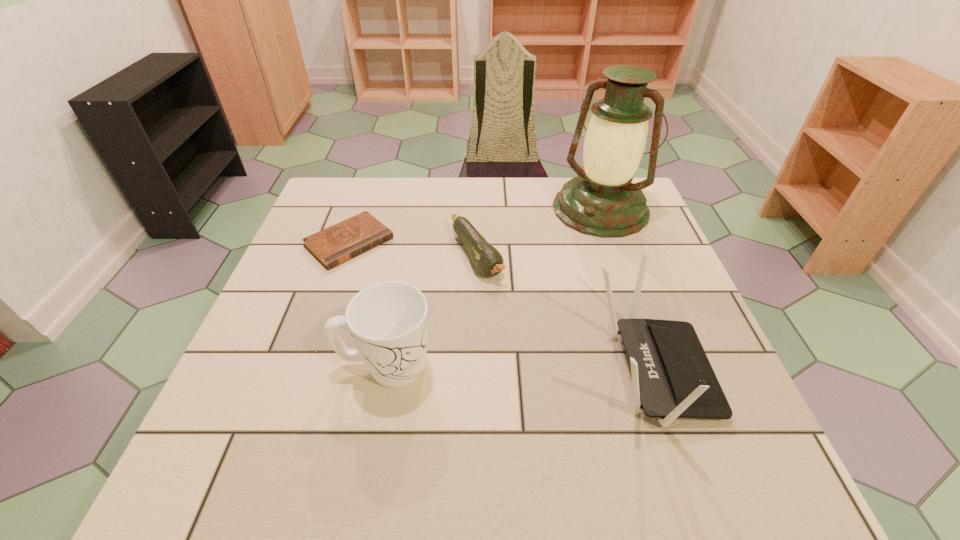
Where is `unoccupied position between the diary and the fourth tallest object`? This screenshot has height=540, width=960. unoccupied position between the diary and the fourth tallest object is located at coordinates (413, 249).

You are a GUI agent. You are given a task and a screenshot of the screen. Output one action in this format:
    pyautogui.click(x=<x>, y=<y>)
    Task: Click on the vacant region between the third object from right to left and the shortest object
    The image size is (960, 540).
    Given the screenshot: What is the action you would take?
    pyautogui.click(x=413, y=249)

Image resolution: width=960 pixels, height=540 pixels. Identify the location of unoccupied area between the diary and the tallest object. (475, 226).

At what (x,y) coordinates should I click in order to perform the action: click on vacant area that lies between the diary and the third object from right to left. Please return your answer as a coordinate pair (x, y). The height and width of the screenshot is (540, 960). Looking at the image, I should click on (413, 249).

Find the location of a particular element. This screenshot has width=960, height=540. free space between the mug and the lantern is located at coordinates (493, 288).

In order to click on free area in between the diary and the lantern in this screenshot , I will do `click(475, 226)`.

You are a GUI agent. You are given a task and a screenshot of the screen. Output one action in this format:
    pyautogui.click(x=<x>, y=<y>)
    Task: Click on the blank region between the tallest object and the router
    This screenshot has height=540, width=960.
    Given the screenshot: What is the action you would take?
    pyautogui.click(x=626, y=291)

You are a GUI agent. You are given a task and a screenshot of the screen. Output one action in this format:
    pyautogui.click(x=<x>, y=<y>)
    Task: Click on the free space between the second shortest object and the diary
    This screenshot has height=540, width=960.
    Given the screenshot: What is the action you would take?
    pyautogui.click(x=413, y=249)

At what (x,y) coordinates should I click in order to perform the action: click on free space between the third object from left to right and the shortest object. Please return your answer as a coordinate pair (x, y). The width and height of the screenshot is (960, 540). Looking at the image, I should click on (413, 249).

In order to click on vacant point located between the router and the diary in this screenshot , I will do click(500, 307).